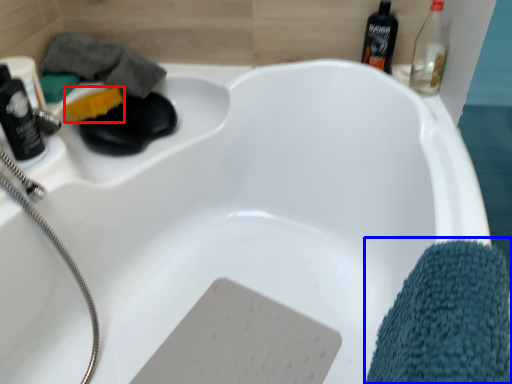
Question: Which object is further to the camera taking this photo, soap (highlighted by a red box) or bath towel (highlighted by a blue box)?

Choices:
 (A) soap
 (B) bath towel

Answer: (A)